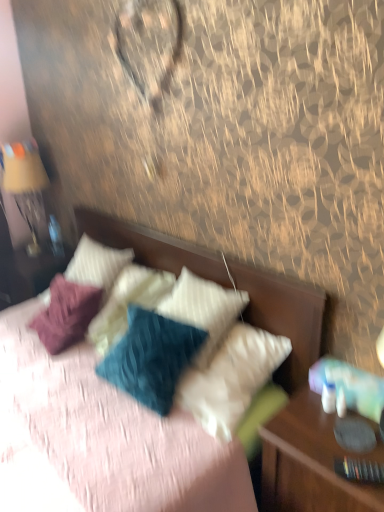
Question: Is matte gold lamp at left at the left side of wooden nightstand at right?

Choices:
 (A) yes
 (B) no

Answer: (A)

Question: Is matte gold lamp at left positioned beyond the bounds of wooden nightstand at right?

Choices:
 (A) yes
 (B) no

Answer: (A)

Question: Is matte gold lamp at left in contact with wooden nightstand at right?

Choices:
 (A) yes
 (B) no

Answer: (B)

Question: Is the depth of matte gold lamp at left less than that of wooden nightstand at right?

Choices:
 (A) yes
 (B) no

Answer: (B)

Question: Considering the relative sizes of matte gold lamp at left and wooden nightstand at right in the image provided, is matte gold lamp at left wider than wooden nightstand at right?

Choices:
 (A) no
 (B) yes

Answer: (A)

Question: Is there a large distance between matte gold lamp at left and wooden nightstand at right?

Choices:
 (A) no
 (B) yes

Answer: (B)

Question: Is wooden nightstand at right smaller than textured fabric bed at center?

Choices:
 (A) no
 (B) yes

Answer: (B)

Question: Is textured fabric bed at center surrounded by wooden nightstand at right?

Choices:
 (A) yes
 (B) no

Answer: (B)

Question: Can you confirm if wooden nightstand at right is wider than textured fabric bed at center?

Choices:
 (A) no
 (B) yes

Answer: (A)

Question: Can you confirm if wooden nightstand at right is thinner than textured fabric bed at center?

Choices:
 (A) yes
 (B) no

Answer: (A)

Question: Is wooden nightstand at right facing towards textured fabric bed at center?

Choices:
 (A) yes
 (B) no

Answer: (B)

Question: Is wooden nightstand at right shorter than textured fabric bed at center?

Choices:
 (A) no
 (B) yes

Answer: (B)

Question: Is white textured pillow at upper center, the first pillow from the right, at the left side of textured fabric bed at center?

Choices:
 (A) no
 (B) yes

Answer: (A)